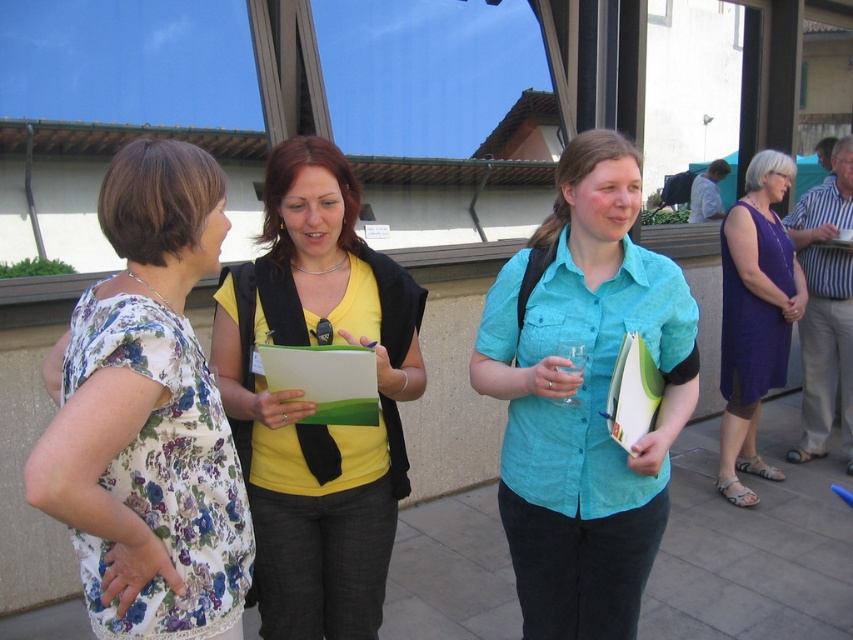
You are standing at the point labeled point (343, 412) and want to walk to the point labeled point (682, 346). Is the destination point behind you or in front of you?

The destination point labeled point (682, 346) is behind the starting point labeled point (343, 412), so it is behind you.

You are a photographer positioned behind the teal cotton shirt at center and the green matte clipboard at center. Which object is closer to your camera lens?

The teal cotton shirt at center is closer to the camera lens because it is positioned further to the viewer compared to the green matte clipboard at center.